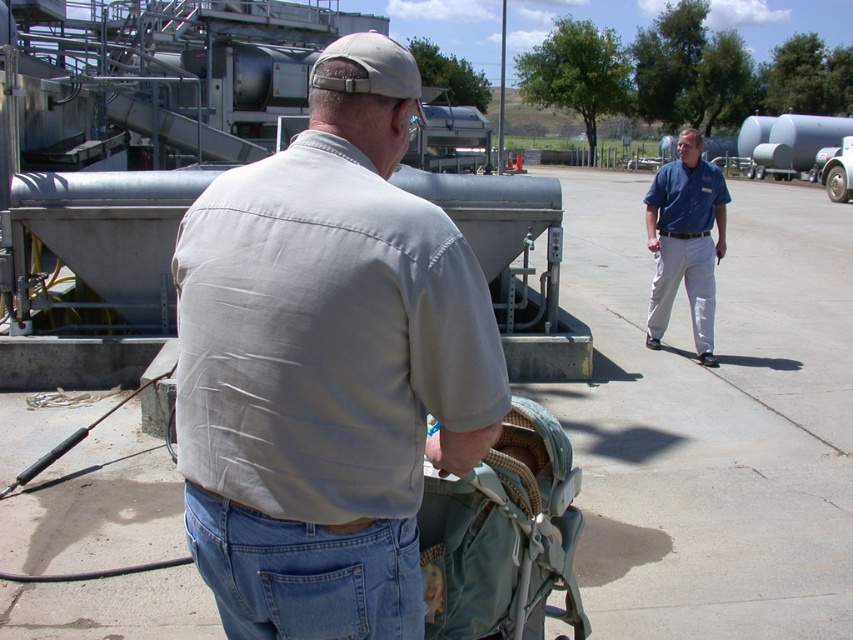
Question: Is concrete at center positioned in front of denim at center?

Choices:
 (A) yes
 (B) no

Answer: (B)

Question: Which is nearer to the light gray cotton shirt at center?

Choices:
 (A) blue cotton shirt at center
 (B) concrete at center
 (C) denim at center

Answer: (C)

Question: Which of the following is the farthest from the observer?

Choices:
 (A) blue cotton shirt at center
 (B) light gray cotton shirt at center
 (C) denim at center
 (D) concrete at center

Answer: (A)

Question: Is light gray cotton shirt at center to the left of blue cotton shirt at center from the viewer's perspective?

Choices:
 (A) yes
 (B) no

Answer: (A)

Question: Which point appears closest to the camera in this image?

Choices:
 (A) (4, 570)
 (B) (349, 625)

Answer: (B)

Question: Is concrete at center above blue cotton shirt at center?

Choices:
 (A) yes
 (B) no

Answer: (A)